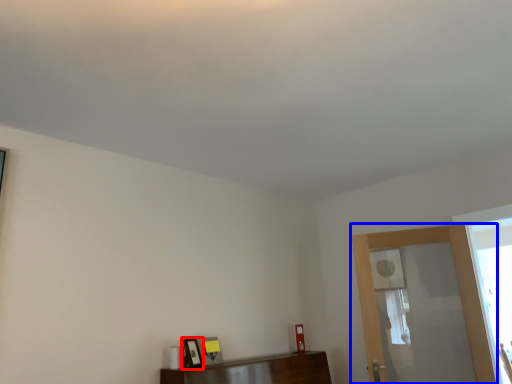
Question: Which object appears farthest to the camera in this image, picture frame (highlighted by a red box) or screen door (highlighted by a blue box)?

Choices:
 (A) picture frame
 (B) screen door

Answer: (B)